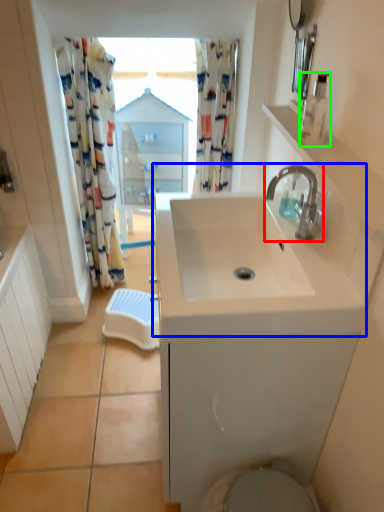
Question: Based on their relative distances, which object is farther from tap (highlighted by a red box)? Choose from sink (highlighted by a blue box) and soap dispenser (highlighted by a green box).

Choices:
 (A) sink
 (B) soap dispenser

Answer: (A)